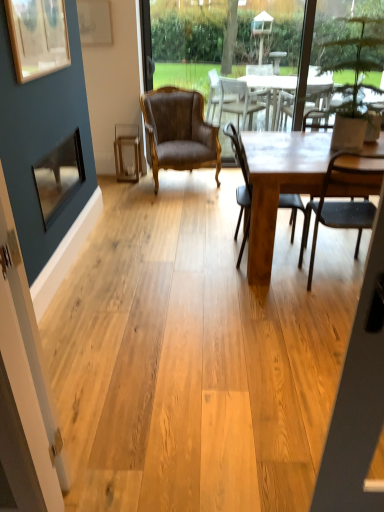
You are a GUI agent. You are given a task and a screenshot of the screen. Output one action in this format:
    pyautogui.click(x=<x>, y=<y>)
    Task: Click on the free location in front of matte brown chair at center, the 1th chair when ordered from right to left
    
    Given the screenshot: What is the action you would take?
    pyautogui.click(x=319, y=317)